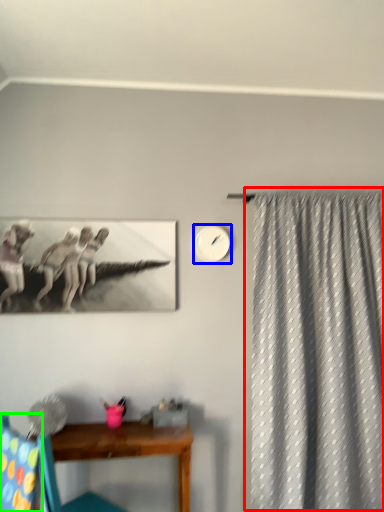
Question: Which object is the closest to the curtain (highlighted by a red box)? Choose among these: clock (highlighted by a blue box) or swivel chair (highlighted by a green box).

Choices:
 (A) clock
 (B) swivel chair

Answer: (A)